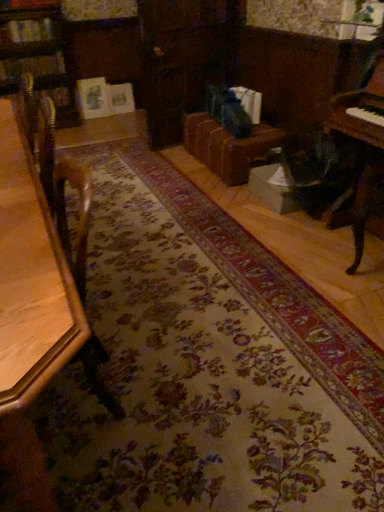
You are a GUI agent. You are given a task and a screenshot of the screen. Output one action in this format:
    pyautogui.click(x=<x>, y=<y>)
    Task: Click on the brown leather couch at center
    This screenshot has width=384, height=512.
    Given the screenshot: What is the action you would take?
    pyautogui.click(x=228, y=147)

This screenshot has width=384, height=512. What do you see at coordinates (228, 147) in the screenshot? I see `brown leather couch at center` at bounding box center [228, 147].

Locate an element on the screen. wooden piano at right is located at coordinates (360, 110).

Locate an element on the screen. wooden table at left is located at coordinates (29, 314).

You are a GUI agent. You are given a task and a screenshot of the screen. Output one action in this format:
    pyautogui.click(x=<x>, y=<y>)
    Task: Click on the brown leather couch at center
    
    Given the screenshot: What is the action you would take?
    pyautogui.click(x=228, y=147)

Between brown leather couch at center and wooden table at left, which one has smaller width?

Thinner between the two is wooden table at left.

Is brown leather couch at center facing towards wooden table at left?

No, brown leather couch at center is not oriented towards wooden table at left.

Is there a large distance between brown leather couch at center and wooden table at left?

Indeed, brown leather couch at center is not near wooden table at left.

Find the location of `table above the brown leather couch at center (from a real-world perspective)`. table above the brown leather couch at center (from a real-world perspective) is located at coordinates (x=29, y=314).

Is wooden table at left behind brown leather couch at center?

No, the depth of wooden table at left is less than that of brown leather couch at center.

Based on the photo, from a real-world perspective, is wooden table at left physically below brown leather couch at center?

No, from a real-world perspective, wooden table at left is not below brown leather couch at center.

Between wooden table at left and brown leather couch at center, which one has more height?

With more height is wooden table at left.

Based on the photo, how different are the orientations of wooden table at left and wooden piano at right in degrees?

The facing directions of wooden table at left and wooden piano at right are 4.11 degrees apart.

Between wooden table at left and wooden piano at right, which one has smaller size?

With smaller size is wooden piano at right.

Would you say wooden table at left contains wooden piano at right?

No, wooden piano at right is not a part of wooden table at left.

From the image's perspective, is wooden table at left under wooden piano at right?

Yes, from the image's perspective, wooden table at left is beneath wooden piano at right.

In terms of width, does wooden piano at right look wider or thinner when compared to brown leather couch at center?

Clearly, wooden piano at right has less width compared to brown leather couch at center.

Considering the relative sizes of wooden piano at right and brown leather couch at center in the image provided, is wooden piano at right smaller than brown leather couch at center?

Indeed, wooden piano at right has a smaller size compared to brown leather couch at center.

The width and height of the screenshot is (384, 512). What are the coordinates of `piano above the brown leather couch at center (from a real-world perspective)` in the screenshot? It's located at (360, 110).

From a real-world perspective, between wooden piano at right and brown leather couch at center, who is vertically lower?

From a 3D spatial view, brown leather couch at center is below.

From a real-world perspective, is wooden piano at right on wooden table at left?

Yes, from a real-world perspective, wooden piano at right is above wooden table at left.

Can we say wooden piano at right lies outside wooden table at left?

wooden piano at right lies outside wooden table at left's area.

From the image's perspective, which is below, wooden piano at right or wooden table at left?

wooden table at left appears lower in the image.

Consider the image. Is brown leather couch at center far from wooden piano at right?

That's right, there is a large distance between brown leather couch at center and wooden piano at right.

From a real-world perspective, is brown leather couch at center beneath wooden piano at right?

Indeed, from a real-world perspective, brown leather couch at center is positioned beneath wooden piano at right.

Between brown leather couch at center and wooden piano at right, which one has larger size?

Bigger between the two is brown leather couch at center.

Which is behind, point (261, 161) or point (375, 128)?

The point (261, 161) is farther.

I want to click on couch that is under the wooden table at left (from a real-world perspective), so click(228, 147).

The width and height of the screenshot is (384, 512). I want to click on table on the left of brown leather couch at center, so click(x=29, y=314).

Estimate the real-world distances between objects in this image. Which object is further from wooden piano at right, wooden table at left or brown leather couch at center?

Based on the image, wooden table at left appears to be further to wooden piano at right.

From the image, which object appears to be farther from brown leather couch at center, wooden table at left or wooden piano at right?

wooden table at left.

Based on their spatial positions, is wooden piano at right or wooden table at left closer to brown leather couch at center?

wooden piano at right is closer to brown leather couch at center.

From the image, which object appears to be nearer to wooden piano at right, brown leather couch at center or wooden table at left?

brown leather couch at center.

Considering their positions, is wooden piano at right positioned closer to wooden table at left than brown leather couch at center?

The object closer to wooden table at left is wooden piano at right.

When comparing their distances from wooden table at left, does brown leather couch at center or wooden piano at right seem further?

brown leather couch at center is further to wooden table at left.

At what (x,y) coordinates should I click in order to perform the action: click on piano between wooden table at left and brown leather couch at center in the front-back direction. Please return your answer as a coordinate pair (x, y). Looking at the image, I should click on (360, 110).